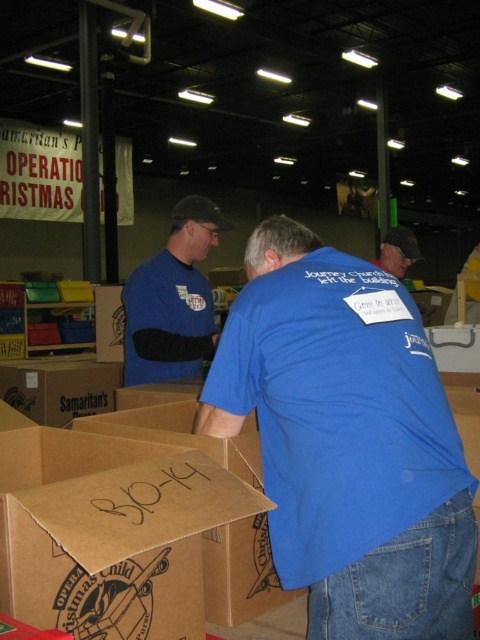
You are a volunteer at the warehouse and need to locate the blue cotton shirt at center. According to the coordinates given, where exactly is it positioned?

The blue cotton shirt at center is positioned at coordinates point [348,440].

Consider the image. You are a delivery person who needs to place a package at the exact location of point (402, 442). The package is 1 meter in length. Can you fit the package horizontally at that point without overlapping any other objects?

The distance between point (402, 442) and the viewer is 99.20 centimeters. Since the package is 1 meter long, it would require at least 100 centimeters of space. However, there is only 99.20 centimeters available, so the package cannot be placed horizontally at that point without overlapping other objects.